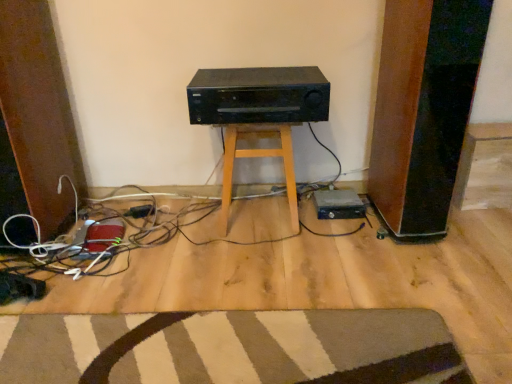
The height and width of the screenshot is (384, 512). I want to click on free spot to the right of wooden stool at center, so click(x=325, y=226).